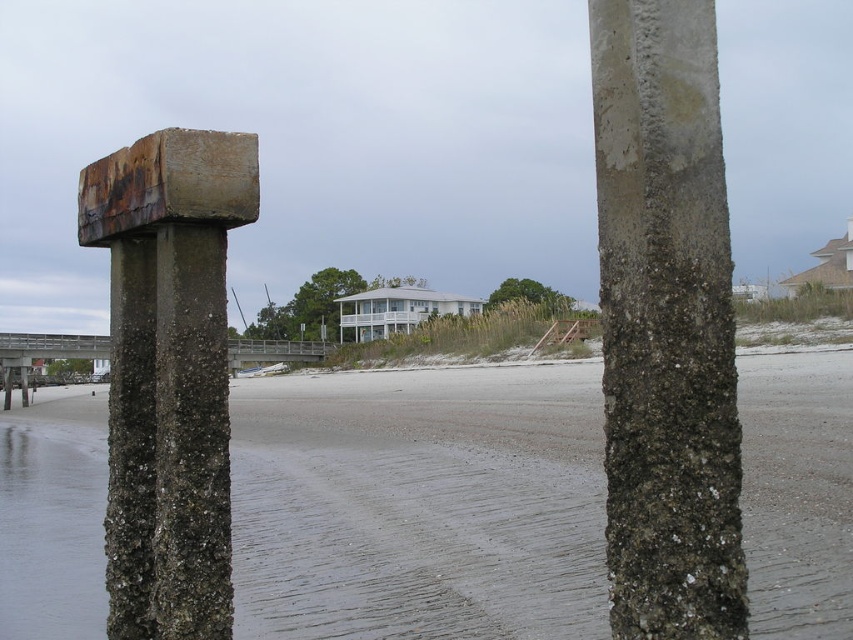
Does sandy gray sand at center have a smaller size compared to clear water at lower left?

Incorrect, sandy gray sand at center is not smaller in size than clear water at lower left.

Is point (396, 461) positioned in front of point (9, 636)?

No, (396, 461) is further to viewer.

Between point (838, 368) and point (96, 604), which one is positioned in front?

Point (96, 604) is more forward.

This screenshot has width=853, height=640. What are the coordinates of `sandy gray sand at center` in the screenshot? It's located at (428, 497).

Who is lower down, rusty concrete post at center or brown wooden dock at center?

rusty concrete post at center is below.

Looking at this image, is the position of rusty concrete post at center less distant than that of brown wooden dock at center?

Yes, rusty concrete post at center is closer to the viewer.

Is point (614, 60) positioned in front of point (572, 326)?

Yes, point (614, 60) is in front of point (572, 326).

Image resolution: width=853 pixels, height=640 pixels. Identify the location of rusty concrete post at center. (665, 324).

Between sandy gray sand at center and brown wooden dock at center, which one has less height?

brown wooden dock at center

Does sandy gray sand at center appear on the left side of brown wooden dock at center?

Correct, you'll find sandy gray sand at center to the left of brown wooden dock at center.

Who is more distant from viewer, (796, 461) or (577, 328)?

The point (577, 328) is behind.

Locate an element on the screen. Image resolution: width=853 pixels, height=640 pixels. sandy gray sand at center is located at coordinates (428, 497).